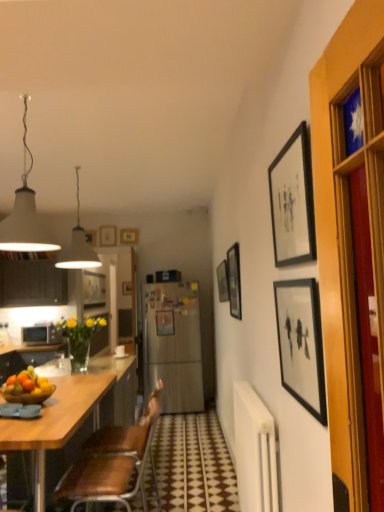
Question: Could you tell me if white matte lampshade at upper left, arranged as the first lamp when viewed from the front, is facing matte silver microwave at left?

Choices:
 (A) yes
 (B) no

Answer: (B)

Question: Is white matte lampshade at upper left, the second lamp viewed from the back, turned away from matte silver microwave at left?

Choices:
 (A) no
 (B) yes

Answer: (A)

Question: Are white matte lampshade at upper left, arranged as the first lamp when viewed from the front, and matte silver microwave at left making contact?

Choices:
 (A) no
 (B) yes

Answer: (A)

Question: Does white matte lampshade at upper left, arranged as the first lamp when viewed from the front, come in front of matte silver microwave at left?

Choices:
 (A) yes
 (B) no

Answer: (A)

Question: Is white matte lampshade at upper left, the second lamp viewed from the back, bigger than matte silver microwave at left?

Choices:
 (A) no
 (B) yes

Answer: (B)

Question: In terms of size, does matte black picture frame at center, the fifth picture frame in the front-to-back sequence, appear bigger or smaller than matte black cabinet at left?

Choices:
 (A) small
 (B) big

Answer: (A)

Question: From the image's perspective, relative to matte black cabinet at left, is matte black picture frame at center, which is counted as the third picture frame, starting from the back, above or below?

Choices:
 (A) above
 (B) below

Answer: (B)

Question: In the image, is matte black picture frame at center, which is counted as the third picture frame, starting from the back, positioned in front of or behind matte black cabinet at left?

Choices:
 (A) front
 (B) behind

Answer: (A)

Question: Considering the positions of matte black picture frame at center, which appears as the 3th picture frame when viewed from the left, and matte black cabinet at left in the image, is matte black picture frame at center, which appears as the 3th picture frame when viewed from the left, taller or shorter than matte black cabinet at left?

Choices:
 (A) short
 (B) tall

Answer: (A)

Question: From the image's perspective, is white matte lampshade at upper left, the second lamp viewed from the back, above or below wooden picture frame at upper center, the second picture frame positioned from the left?

Choices:
 (A) below
 (B) above

Answer: (B)

Question: Looking at their shapes, would you say white matte lampshade at upper left, arranged as the first lamp when viewed from the front, is wider or thinner than wooden picture frame at upper center, which is counted as the second picture frame, starting from the back?

Choices:
 (A) wide
 (B) thin

Answer: (A)

Question: From a real-world perspective, is white matte lampshade at upper left, arranged as the first lamp when viewed from the front, positioned above or below wooden picture frame at upper center, the second picture frame positioned from the left?

Choices:
 (A) below
 (B) above

Answer: (A)

Question: Considering the positions of white matte lampshade at upper left, arranged as the first lamp when viewed from the front, and wooden picture frame at upper center, the second picture frame positioned from the left, in the image, is white matte lampshade at upper left, arranged as the first lamp when viewed from the front, bigger or smaller than wooden picture frame at upper center, the second picture frame positioned from the left,?

Choices:
 (A) big
 (B) small

Answer: (A)

Question: Would you say white matte lampshade at upper left, arranged as the first lamp when viewed from the front, is inside or outside matte black picture frame at upper center, which appears as the fourth picture frame when viewed from the back?

Choices:
 (A) outside
 (B) inside

Answer: (A)

Question: From their relative heights in the image, would you say white matte lampshade at upper left, arranged as the first lamp when viewed from the front, is taller or shorter than matte black picture frame at upper center, the fourth picture frame viewed from the right?

Choices:
 (A) short
 (B) tall

Answer: (B)